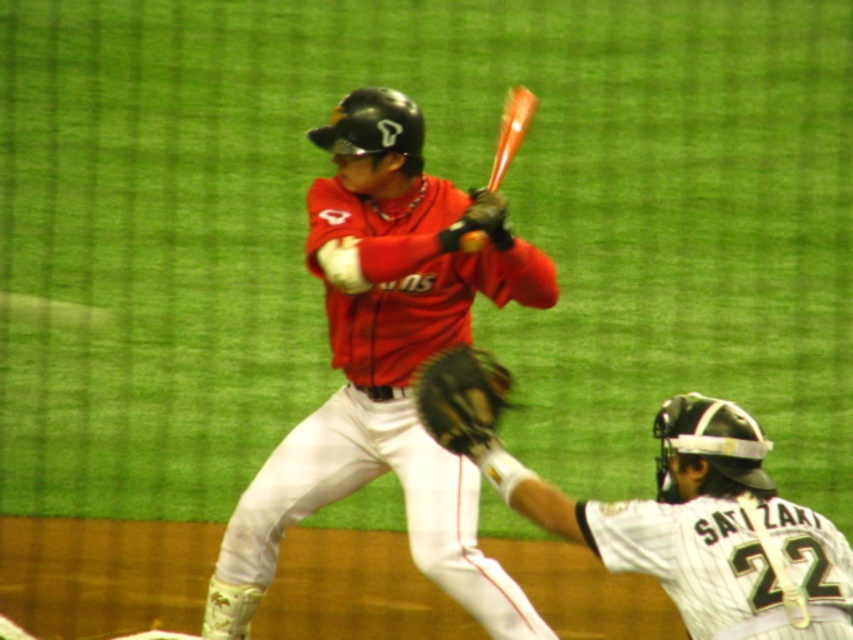
Question: Among these points, which one is farthest from the camera?

Choices:
 (A) (495, 424)
 (B) (469, 243)
 (C) (444, 461)

Answer: (C)

Question: Is matte red jersey at center positioned at the back of orange wood bat at center?

Choices:
 (A) no
 (B) yes

Answer: (B)

Question: Observing the image, what is the correct spatial positioning of brown leather glove at center in reference to shiny orange baseball at center?

Choices:
 (A) above
 (B) below

Answer: (B)

Question: Considering the real-world distances, which object is farthest from the shiny orange baseball at center?

Choices:
 (A) white textured uniform at center
 (B) orange wood bat at center

Answer: (A)

Question: Can you confirm if matte red jersey at center is positioned above orange wood bat at center?

Choices:
 (A) no
 (B) yes

Answer: (A)

Question: Based on their relative distances, which object is farther from the white textured uniform at center?

Choices:
 (A) shiny orange baseball at center
 (B) matte red jersey at center
 (C) orange wood bat at center

Answer: (C)